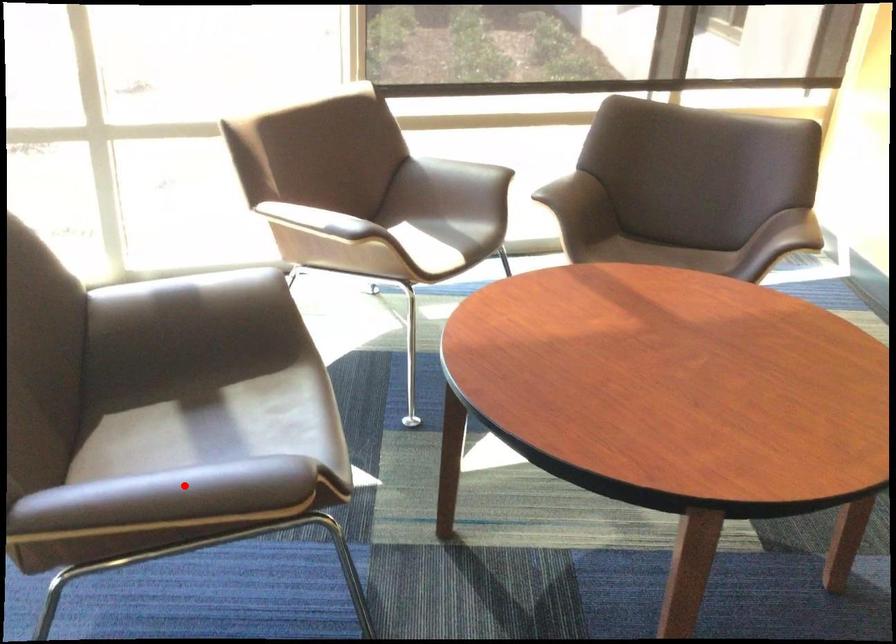
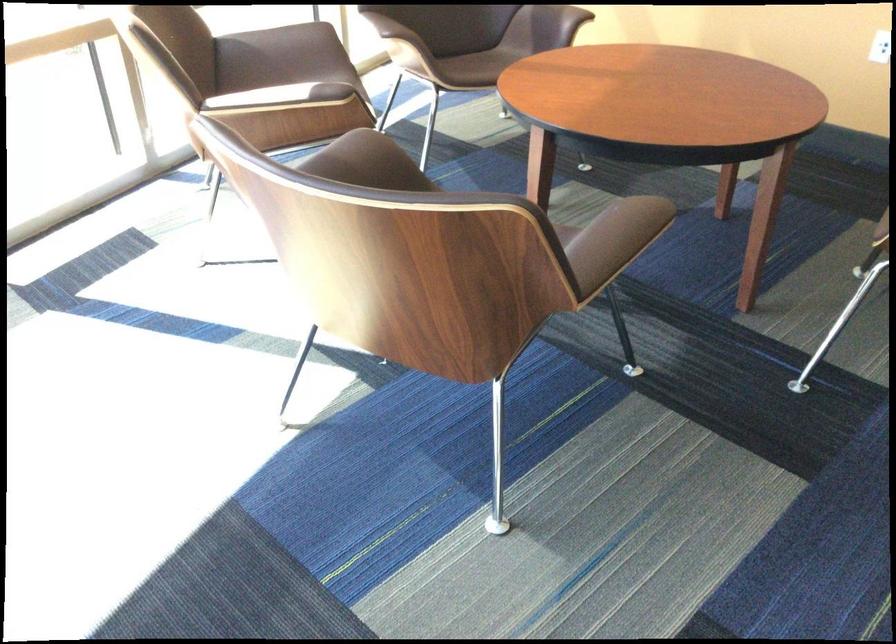
Question: I am providing you with two images of the same scene from different viewpoints. Image1 has a red point marked. In image2, the corresponding 3D location appears at what relative position? Reply with the corresponding letter.

Choices:
 (A) Closer
 (B) Farther

Answer: (B)